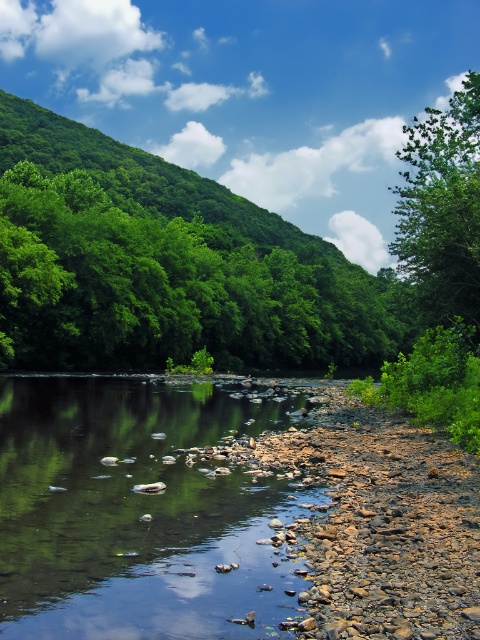
Question: Among these objects, which one is nearest to the camera?

Choices:
 (A) green leafy hillside at upper left
 (B) smooth rock river at center
 (C) green leafy tree at upper right

Answer: (B)

Question: Is green leafy hillside at upper left to the right of smooth rock river at center from the viewer's perspective?

Choices:
 (A) no
 (B) yes

Answer: (A)

Question: Is smooth rock river at center behind green leafy tree at upper right?

Choices:
 (A) yes
 (B) no

Answer: (B)

Question: Which object appears closest to the camera in this image?

Choices:
 (A) smooth rock river at center
 (B) green leafy hillside at upper left
 (C) green leafy tree at upper right

Answer: (A)

Question: Which object is the farthest from the green leafy tree at upper right?

Choices:
 (A) smooth rock river at center
 (B) green leafy hillside at upper left

Answer: (B)

Question: Considering the relative positions of green leafy hillside at upper left and green leafy tree at upper right in the image provided, where is green leafy hillside at upper left located with respect to green leafy tree at upper right?

Choices:
 (A) below
 (B) above

Answer: (A)